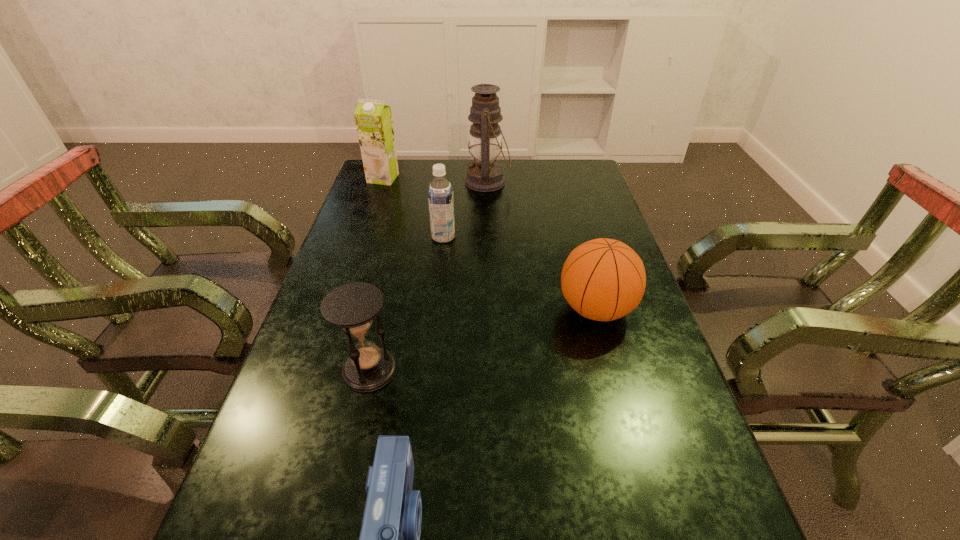
Find the location of `vacant space at the far edge of the desktop`. vacant space at the far edge of the desktop is located at coordinates [545, 174].

Image resolution: width=960 pixels, height=540 pixels. What are the coordinates of `vacant space at the left edge of the desktop` in the screenshot? It's located at tap(362, 215).

Identify the location of vacant space at the right edge of the desktop. (572, 211).

In the image, there is a desktop. Where is `free space at the far left corner`? free space at the far left corner is located at coordinates (400, 184).

Where is `vacant region at the far right corner`? This screenshot has height=540, width=960. vacant region at the far right corner is located at coordinates (565, 169).

Identify the location of vacant region between the hourglass and the tallest object. Image resolution: width=960 pixels, height=540 pixels. (428, 276).

You are a GUI agent. You are given a task and a screenshot of the screen. Output one action in this format:
    pyautogui.click(x=<x>, y=<y>)
    Task: Click on the blank region between the fifth farthest object and the third farthest object
    
    Given the screenshot: What is the action you would take?
    pyautogui.click(x=406, y=303)

Find the location of a particular element. free space between the left soya milk and the hourglass is located at coordinates (376, 274).

You are a GUI agent. You are given a task and a screenshot of the screen. Output one action in this format:
    pyautogui.click(x=<x>, y=<y>)
    Task: Click on the empty space that is in between the fifth farthest object and the third farthest object
    This screenshot has width=960, height=540.
    Given the screenshot: What is the action you would take?
    pyautogui.click(x=406, y=303)

You are a GUI agent. You are given a task and a screenshot of the screen. Output one action in this format:
    pyautogui.click(x=<x>, y=<y>)
    Task: Click on the empty space between the fourth farthest object and the hourglass
    The width and height of the screenshot is (960, 540).
    Given the screenshot: What is the action you would take?
    pyautogui.click(x=483, y=340)